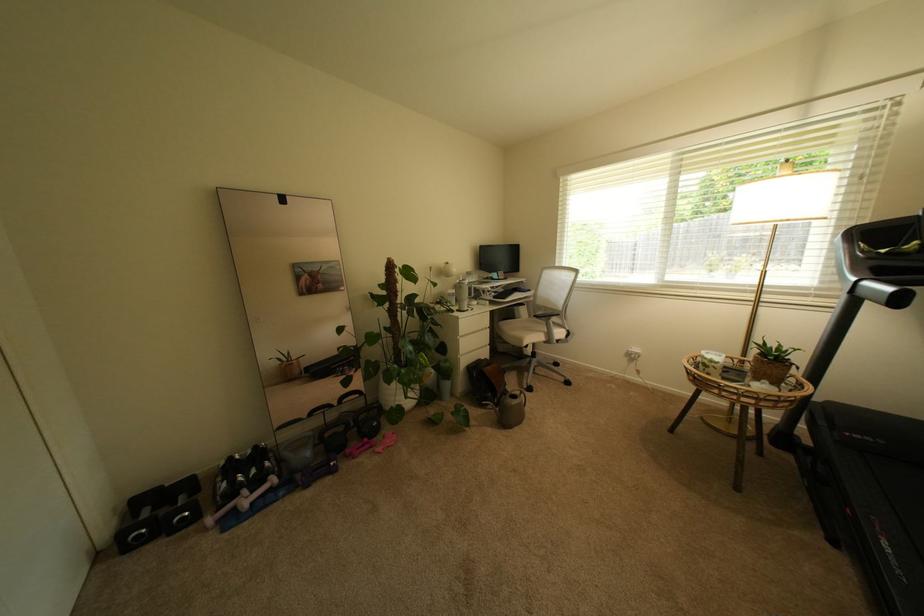
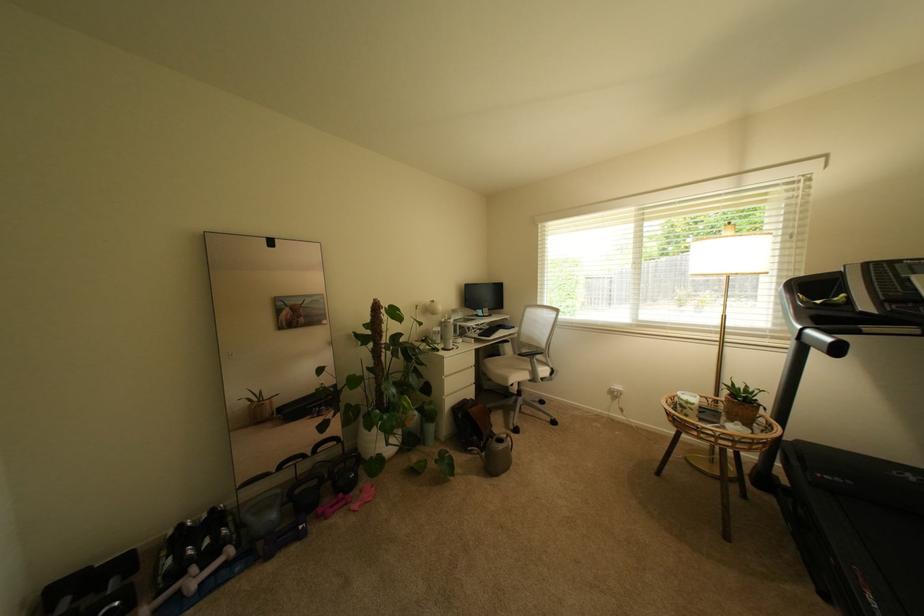
In the second image, find the point that corresponds to [468,359] in the first image.

(453, 400)